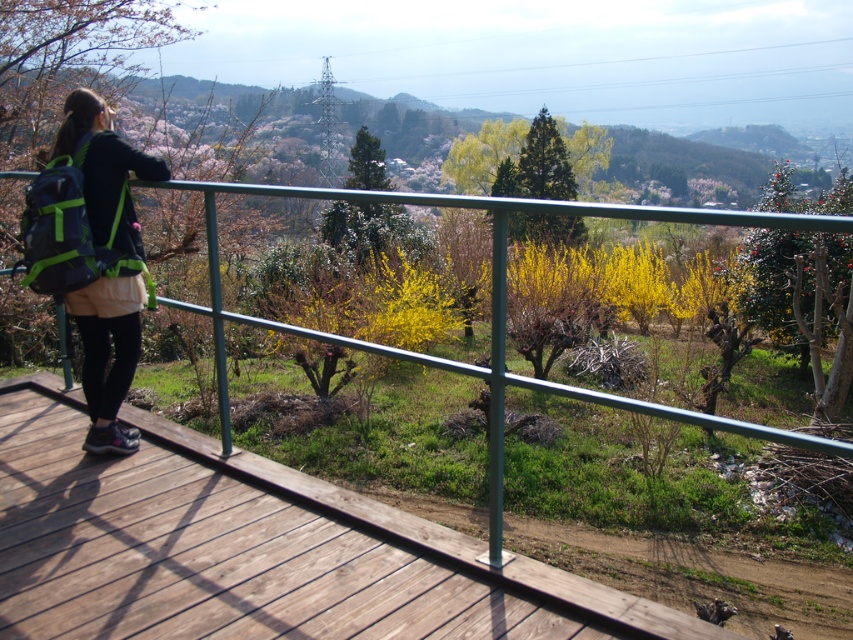
Question: Is brown wooden deck at lower left bigger than matte black backpack at left?

Choices:
 (A) no
 (B) yes

Answer: (B)

Question: Does brown wooden deck at lower left have a larger size compared to matte black backpack at left?

Choices:
 (A) no
 (B) yes

Answer: (B)

Question: Which point is closer to the camera?

Choices:
 (A) brown wooden deck at lower left
 (B) matte black backpack at left

Answer: (A)

Question: Among these objects, which one is farthest from the camera?

Choices:
 (A) matte black backpack at left
 (B) brown wooden deck at lower left

Answer: (A)

Question: Which of the following is the closest to the observer?

Choices:
 (A) brown wooden deck at lower left
 (B) matte black backpack at left

Answer: (A)

Question: Does brown wooden deck at lower left have a smaller size compared to matte black backpack at left?

Choices:
 (A) yes
 (B) no

Answer: (B)